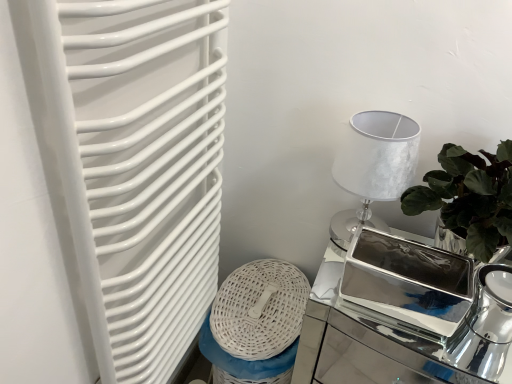
Question: Can you confirm if polished silver tea pot at right is smaller than polished silver tray at right?

Choices:
 (A) yes
 (B) no

Answer: (A)

Question: From a real-world perspective, is polished silver tea pot at right positioned over polished silver tray at right based on gravity?

Choices:
 (A) yes
 (B) no

Answer: (A)

Question: Can you confirm if polished silver tea pot at right is wider than polished silver tray at right?

Choices:
 (A) no
 (B) yes

Answer: (A)

Question: From the image's perspective, is polished silver tea pot at right located above polished silver tray at right?

Choices:
 (A) yes
 (B) no

Answer: (A)

Question: Does polished silver tea pot at right have a lesser height compared to polished silver tray at right?

Choices:
 (A) yes
 (B) no

Answer: (A)

Question: Is polished silver tea pot at right facing towards polished silver tray at right?

Choices:
 (A) no
 (B) yes

Answer: (A)

Question: From a real-world perspective, is silver metallic table lamp at upper right below polished silver tea pot at right?

Choices:
 (A) yes
 (B) no

Answer: (B)

Question: Is silver metallic table lamp at upper right far from polished silver tea pot at right?

Choices:
 (A) yes
 (B) no

Answer: (B)

Question: From the image's perspective, is silver metallic table lamp at upper right located beneath polished silver tea pot at right?

Choices:
 (A) no
 (B) yes

Answer: (A)

Question: Is silver metallic table lamp at upper right taller than polished silver tea pot at right?

Choices:
 (A) yes
 (B) no

Answer: (A)

Question: Can you confirm if silver metallic table lamp at upper right is wider than polished silver tea pot at right?

Choices:
 (A) yes
 (B) no

Answer: (A)

Question: Can we say silver metallic table lamp at upper right lies outside polished silver tea pot at right?

Choices:
 (A) no
 (B) yes

Answer: (B)

Question: Is silver metallic table lamp at upper right shorter than polished silver tray at right?

Choices:
 (A) yes
 (B) no

Answer: (A)